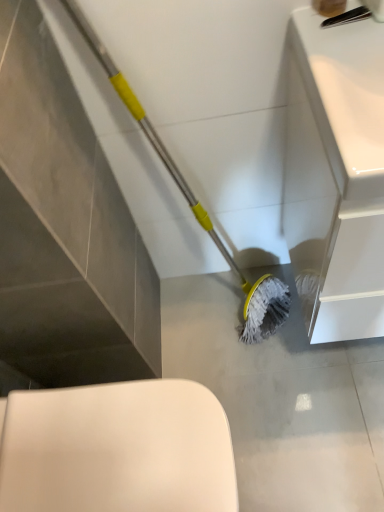
Question: Does white glossy toilet at lower left have a lesser width compared to gray matte mop head at lower center?

Choices:
 (A) yes
 (B) no

Answer: (A)

Question: Is white glossy toilet at lower left outside gray matte mop head at lower center?

Choices:
 (A) no
 (B) yes

Answer: (B)

Question: Considering the relative sizes of white glossy toilet at lower left and gray matte mop head at lower center in the image provided, is white glossy toilet at lower left bigger than gray matte mop head at lower center?

Choices:
 (A) no
 (B) yes

Answer: (B)

Question: Considering the relative sizes of white glossy toilet at lower left and gray matte mop head at lower center in the image provided, is white glossy toilet at lower left taller than gray matte mop head at lower center?

Choices:
 (A) yes
 (B) no

Answer: (A)

Question: Is white glossy toilet at lower left touching gray matte mop head at lower center?

Choices:
 (A) yes
 (B) no

Answer: (B)

Question: Considering the positions of gray matte mop head at lower center and white glossy sink at upper right in the image, is gray matte mop head at lower center wider or thinner than white glossy sink at upper right?

Choices:
 (A) wide
 (B) thin

Answer: (A)

Question: Is gray matte mop head at lower center to the left or to the right of white glossy sink at upper right in the image?

Choices:
 (A) right
 (B) left

Answer: (B)

Question: Is gray matte mop head at lower center inside or outside of white glossy sink at upper right?

Choices:
 (A) inside
 (B) outside

Answer: (B)

Question: Looking at the image, does gray matte mop head at lower center seem bigger or smaller compared to white glossy sink at upper right?

Choices:
 (A) big
 (B) small

Answer: (B)

Question: Based on their positions, is white glossy sink at upper right located to the left or right of white glossy toilet at lower left?

Choices:
 (A) right
 (B) left

Answer: (A)

Question: In terms of size, does white glossy sink at upper right appear bigger or smaller than white glossy toilet at lower left?

Choices:
 (A) small
 (B) big

Answer: (B)

Question: Would you say white glossy sink at upper right is inside or outside white glossy toilet at lower left?

Choices:
 (A) outside
 (B) inside

Answer: (A)

Question: Considering the positions of white glossy sink at upper right and white glossy toilet at lower left in the image, is white glossy sink at upper right wider or thinner than white glossy toilet at lower left?

Choices:
 (A) wide
 (B) thin

Answer: (B)

Question: From a real-world perspective, is white glossy toilet at lower left positioned above or below white glossy sink at upper right?

Choices:
 (A) below
 (B) above

Answer: (A)

Question: Visually, is white glossy toilet at lower left positioned to the left or to the right of white glossy sink at upper right?

Choices:
 (A) left
 (B) right

Answer: (A)